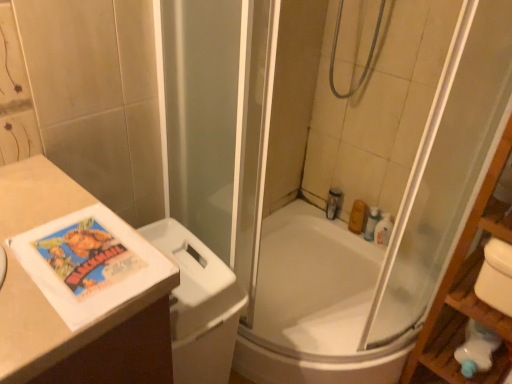
What is the approximate width of orange matte soap at upper right, which is counted as the second toiletry, starting from the left?

It is 2.24 inches.

The image size is (512, 384). I want to click on metallic silver toiletry at upper right, the first toiletry positioned from the left, so click(x=334, y=203).

The image size is (512, 384). I want to click on toilet bowl below the orange matte soap at upper right, which appears as the third toiletry when viewed from the right (from the image's perspective), so click(199, 306).

Is orange matte soap at upper right, which is counted as the second toiletry, starting from the left, facing towards white plastic toilet bowl at left?

Yes, orange matte soap at upper right, which is counted as the second toiletry, starting from the left, is facing white plastic toilet bowl at left.

Does orange matte soap at upper right, which is counted as the second toiletry, starting from the left, have a lesser width compared to white plastic toilet bowl at left?

Correct, the width of orange matte soap at upper right, which is counted as the second toiletry, starting from the left, is less than that of white plastic toilet bowl at left.

Is white plastic toilet bowl at left surrounded by orange matte soap at upper right, which is counted as the second toiletry, starting from the left?

No, white plastic toilet bowl at left is located outside of orange matte soap at upper right, which is counted as the second toiletry, starting from the left.

From a real-world perspective, is white plastic bottle at upper right, which is the 3th toiletry from left to right, positioned above or below wooden shelf at right?

white plastic bottle at upper right, which is the 3th toiletry from left to right, is below wooden shelf at right.

How many degrees apart are the facing directions of white plastic bottle at upper right, the 2th toiletry when ordered from right to left, and wooden shelf at right?

They differ by 1.36 degrees in their facing directions.

Which object is further away from the camera taking this photo, white plastic bottle at upper right, the 2th toiletry when ordered from right to left, or wooden shelf at right?

Positioned behind is white plastic bottle at upper right, the 2th toiletry when ordered from right to left.

In terms of width, does white plastic bottle at upper right, the 2th toiletry when ordered from right to left, look wider or thinner when compared to wooden shelf at right?

In the image, white plastic bottle at upper right, the 2th toiletry when ordered from right to left, appears to be more narrow than wooden shelf at right.

Can you confirm if wooden shelf at right is positioned to the left of orange matte soap at upper right, which is counted as the second toiletry, starting from the left?

In fact, wooden shelf at right is to the right of orange matte soap at upper right, which is counted as the second toiletry, starting from the left.

Is wooden shelf at right inside the boundaries of orange matte soap at upper right, which appears as the third toiletry when viewed from the right, or outside?

wooden shelf at right is not inside orange matte soap at upper right, which appears as the third toiletry when viewed from the right, it's outside.

Consider the image. Is wooden shelf at right facing towards orange matte soap at upper right, which is counted as the second toiletry, starting from the left?

No, wooden shelf at right is not facing towards orange matte soap at upper right, which is counted as the second toiletry, starting from the left.

Considering the relative positions of white plastic toilet bowl at left and white plastic bottle at upper right, the 2th toiletry when ordered from right to left, in the image provided, is white plastic toilet bowl at left to the left of white plastic bottle at upper right, the 2th toiletry when ordered from right to left, from the viewer's perspective?

Yes.

Who is shorter, white plastic toilet bowl at left or white plastic bottle at upper right, the 2th toiletry when ordered from right to left?

white plastic bottle at upper right, the 2th toiletry when ordered from right to left, is shorter.

Can you tell me how much white plastic toilet bowl at left and white plastic bottle at upper right, which is the 3th toiletry from left to right, differ in facing direction?

white plastic toilet bowl at left and white plastic bottle at upper right, which is the 3th toiletry from left to right, are facing 91.8 degrees away from each other.

Is white plastic toilet bowl at left next to white plastic bottle at upper right, the 2th toiletry when ordered from right to left?

No, white plastic toilet bowl at left is not beside white plastic bottle at upper right, the 2th toiletry when ordered from right to left.

Considering the relative sizes of wooden shelf at right and white glossy bathtub at center in the image provided, is wooden shelf at right taller than white glossy bathtub at center?

Yes.

From the image's perspective, which one is positioned lower, wooden shelf at right or white glossy bathtub at center?

white glossy bathtub at center appears lower in the image.

Looking at this image, is wooden shelf at right looking in the opposite direction of white glossy bathtub at center?

No, wooden shelf at right is not facing away from white glossy bathtub at center.

Are wooden shelf at right and white glossy bathtub at center beside each other?

No, wooden shelf at right is not making contact with white glossy bathtub at center.

At what (x,y) coordinates should I click in order to perform the action: click on toilet bowl in front of the white plastic bottle at upper right, which is the 3th toiletry from left to right. Please return your answer as a coordinate pair (x, y). Looking at the image, I should click on (199, 306).

Is point (375, 208) farther from camera compared to point (188, 356)?

Yes, point (375, 208) is behind point (188, 356).

Which object is wider, white plastic bottle at upper right, the 2th toiletry when ordered from right to left, or white plastic toilet bowl at left?

Wider between the two is white plastic toilet bowl at left.

Who is taller, white plastic bottle at upper right, which is the 3th toiletry from left to right, or white plastic toilet bowl at left?

white plastic toilet bowl at left is taller.

From the image's perspective, which is below, wooden shelf at right or metallic silver toiletry at upper right, marked as the 4th toiletry in a right-to-left arrangement?

wooden shelf at right, from the image's perspective.

Considering the relative sizes of wooden shelf at right and metallic silver toiletry at upper right, marked as the 4th toiletry in a right-to-left arrangement, in the image provided, is wooden shelf at right shorter than metallic silver toiletry at upper right, marked as the 4th toiletry in a right-to-left arrangement,?

No.

Identify the location of the 4th toiletry above the wooden shelf at right (from the image's perspective). (334, 203).

Is wooden shelf at right bigger or smaller than metallic silver toiletry at upper right, marked as the 4th toiletry in a right-to-left arrangement?

wooden shelf at right is bigger than metallic silver toiletry at upper right, marked as the 4th toiletry in a right-to-left arrangement.

The width and height of the screenshot is (512, 384). Identify the location of the 3rd toiletry below the white plastic toilet bowl at left (from a real-world perspective). 358,217.

Where is `shelf lying below the white plastic bottle at upper right, which is the 3th toiletry from left to right (from the image's perspective)`? shelf lying below the white plastic bottle at upper right, which is the 3th toiletry from left to right (from the image's perspective) is located at coordinates pyautogui.click(x=467, y=290).

Estimate the real-world distances between objects in this image. Which object is closer to white plastic bottle at upper right, the 2th toiletry when ordered from right to left, orange matte soap at upper right, which appears as the third toiletry when viewed from the right, or white plastic toilet bowl at left?

orange matte soap at upper right, which appears as the third toiletry when viewed from the right.

Considering their positions, is white glossy bathtub at center positioned closer to white plastic toilet bowl at left than orange matte soap at upper right, which appears as the third toiletry when viewed from the right?

Among the two, white glossy bathtub at center is located nearer to white plastic toilet bowl at left.

When comparing their distances from orange matte soap at upper right, which is counted as the second toiletry, starting from the left, does white plastic bottle at upper right, the 2th toiletry when ordered from right to left, or metallic silver toiletry at upper right, marked as the 4th toiletry in a right-to-left arrangement, seem closer?

Based on the image, white plastic bottle at upper right, the 2th toiletry when ordered from right to left, appears to be nearer to orange matte soap at upper right, which is counted as the second toiletry, starting from the left.

From the image, which object appears to be nearer to translucent plastic soap at upper right, placed as the 1th toiletry when sorted from right to left, white plastic toilet bowl at left or white plastic bottle at upper right, the 2th toiletry when ordered from right to left?

white plastic bottle at upper right, the 2th toiletry when ordered from right to left, is positioned closer to the anchor translucent plastic soap at upper right, placed as the 1th toiletry when sorted from right to left.

Based on their spatial positions, is white glossy bathtub at center or translucent plastic soap at upper right, placed as the 1th toiletry when sorted from right to left, further from white plastic toilet bowl at left?

The object further to white plastic toilet bowl at left is translucent plastic soap at upper right, placed as the 1th toiletry when sorted from right to left.

Estimate the real-world distances between objects in this image. Which object is closer to translucent plastic soap at upper right, placed as the 1th toiletry when sorted from right to left, white glossy bathtub at center or orange matte soap at upper right, which is counted as the second toiletry, starting from the left?

orange matte soap at upper right, which is counted as the second toiletry, starting from the left, lies closer to translucent plastic soap at upper right, placed as the 1th toiletry when sorted from right to left, than the other object.

Considering their positions, is white glossy bathtub at center positioned closer to metallic silver toiletry at upper right, the first toiletry positioned from the left, than translucent plastic soap at upper right, placed as the 1th toiletry when sorted from right to left?

Based on the image, translucent plastic soap at upper right, placed as the 1th toiletry when sorted from right to left, appears to be nearer to metallic silver toiletry at upper right, the first toiletry positioned from the left.

Considering their positions, is white plastic bottle at upper right, which is the 3th toiletry from left to right, positioned closer to translucent plastic soap at upper right, placed as the 1th toiletry when sorted from right to left, than orange matte soap at upper right, which appears as the third toiletry when viewed from the right?

white plastic bottle at upper right, which is the 3th toiletry from left to right, lies closer to translucent plastic soap at upper right, placed as the 1th toiletry when sorted from right to left, than the other object.

Image resolution: width=512 pixels, height=384 pixels. I want to click on bathtub positioned between white plastic toilet bowl at left and metallic silver toiletry at upper right, the first toiletry positioned from the left, from near to far, so click(x=315, y=306).

Locate an element on the screen. The width and height of the screenshot is (512, 384). toiletry situated between orange matte soap at upper right, which appears as the third toiletry when viewed from the right, and translucent plastic soap at upper right, placed as the fourth toiletry when sorted from left to right, from left to right is located at coordinates (372, 223).

The image size is (512, 384). Find the location of `bathtub between white plastic toilet bowl at left and orange matte soap at upper right, which appears as the third toiletry when viewed from the right, in the front-back direction`. bathtub between white plastic toilet bowl at left and orange matte soap at upper right, which appears as the third toiletry when viewed from the right, in the front-back direction is located at coordinates (315, 306).

In order to click on toilet bowl located between wooden shelf at right and white plastic bottle at upper right, the 2th toiletry when ordered from right to left, in the depth direction in this screenshot , I will do (x=199, y=306).